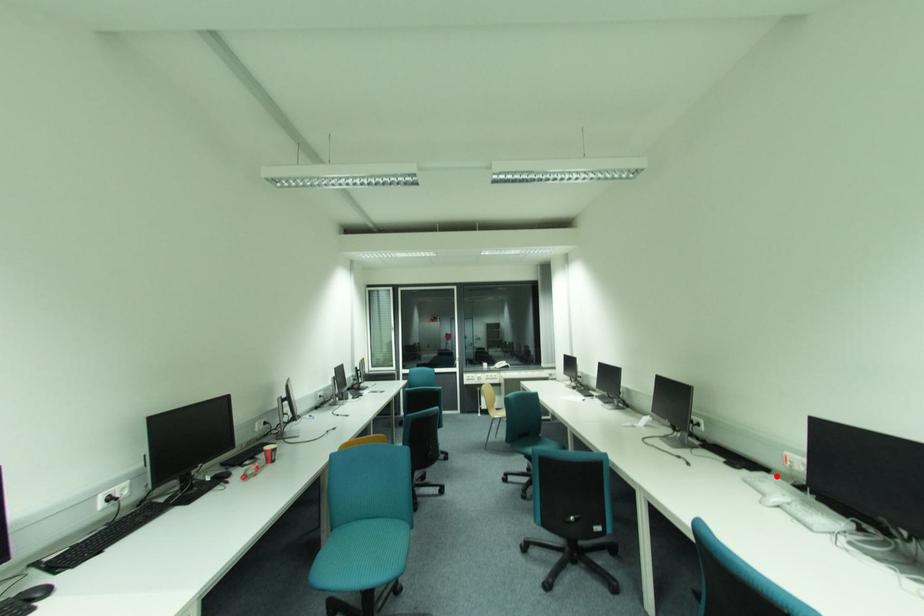
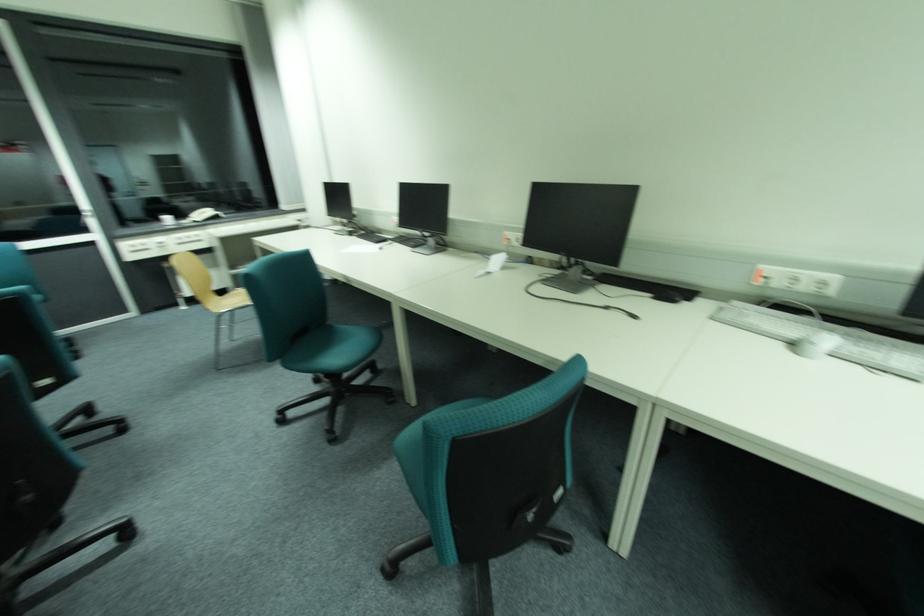
The point at the highlighted location is marked in the first image. Where is the corresponding point in the second image?

(743, 304)